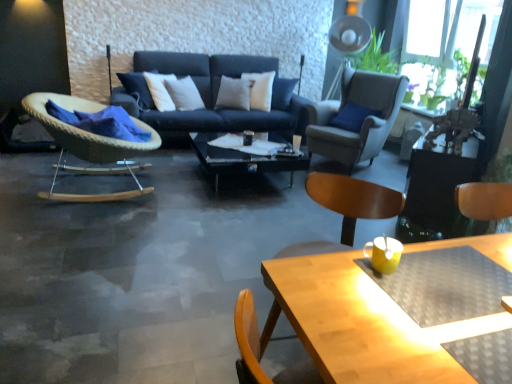
The height and width of the screenshot is (384, 512). Describe the element at coordinates (87, 143) in the screenshot. I see `woven wood rocking chair at left, acting as the 2th chair starting from the right` at that location.

Find the location of a particular element. The image size is (512, 384). green leafy plant at upper right is located at coordinates (433, 84).

Where is `transparent glass coffee table at center`? transparent glass coffee table at center is located at coordinates (241, 160).

This screenshot has width=512, height=384. What are the coordinates of `wooden beach chair at lower right` in the screenshot? It's located at tap(346, 208).

The height and width of the screenshot is (384, 512). I want to click on woven wood rocking chair at left, acting as the 2th chair starting from the right, so click(x=87, y=143).

From the picture: From a real-world perspective, is suede-like beige armchair at upper right, which appears as the second chair when viewed from the left, on woven wood rocking chair at left, arranged as the first chair when viewed from the left?

Yes, from a real-world perspective, suede-like beige armchair at upper right, which appears as the second chair when viewed from the left, is over woven wood rocking chair at left, arranged as the first chair when viewed from the left

Consider the image. Does suede-like beige armchair at upper right, which appears as the second chair when viewed from the left, turn towards woven wood rocking chair at left, acting as the 2th chair starting from the right?

Yes, suede-like beige armchair at upper right, which appears as the second chair when viewed from the left, is turned towards woven wood rocking chair at left, acting as the 2th chair starting from the right.

Considering the sizes of objects suede-like beige armchair at upper right, which appears as the second chair when viewed from the left, and woven wood rocking chair at left, arranged as the first chair when viewed from the left, in the image provided, who is smaller, suede-like beige armchair at upper right, which appears as the second chair when viewed from the left, or woven wood rocking chair at left, arranged as the first chair when viewed from the left,?

Smaller between the two is suede-like beige armchair at upper right, which appears as the second chair when viewed from the left.

Would you say suede-like beige armchair at upper right, arranged as the 1th chair when viewed from the right, is outside woven wood rocking chair at left, acting as the 2th chair starting from the right?

Yes.

Does wooden table at lower right have a smaller size compared to black glossy side table at right?

Yes, wooden table at lower right is smaller than black glossy side table at right.

Can you confirm if wooden table at lower right is thinner than black glossy side table at right?

Incorrect, the width of wooden table at lower right is not less than that of black glossy side table at right.

Is wooden table at lower right at the right side of black glossy side table at right?

No.

In the scene shown: Is wooden table at lower right positioned in front of black glossy side table at right?

Yes, it is.

Considering the sizes of objects black glossy side table at right and transparent glass coffee table at center in the image provided, who is shorter, black glossy side table at right or transparent glass coffee table at center?

transparent glass coffee table at center.

Is black glossy side table at right oriented away from transparent glass coffee table at center?

No, black glossy side table at right is not facing the opposite direction of transparent glass coffee table at center.

From the image's perspective, is black glossy side table at right on top of transparent glass coffee table at center?

No, from the image's perspective, black glossy side table at right is not on top of transparent glass coffee table at center.

Who is smaller, black glossy side table at right or transparent glass coffee table at center?

With smaller size is transparent glass coffee table at center.

From a real-world perspective, is suede-like beige armchair at upper right, arranged as the 1th chair when viewed from the right, below green leafy plant at upper right?

Yes.

Is suede-like beige armchair at upper right, which appears as the second chair when viewed from the left, turned away from green leafy plant at upper right?

Yes, green leafy plant at upper right is at the back of suede-like beige armchair at upper right, which appears as the second chair when viewed from the left.

Does suede-like beige armchair at upper right, which appears as the second chair when viewed from the left, have a greater width compared to green leafy plant at upper right?

Correct, the width of suede-like beige armchair at upper right, which appears as the second chair when viewed from the left, exceeds that of green leafy plant at upper right.

From the green leafy plant at upper right, count the 1st chair to the left and point to it. Please provide its 2D coordinates.

[(357, 118)]

In the image, is wooden beach chair at lower right positioned in front of or behind green leafy plant at upper right?

Result: Visually, wooden beach chair at lower right is located in front of green leafy plant at upper right.

Where is `beach chair lying below the green leafy plant at upper right (from the image's perspective)`? This screenshot has width=512, height=384. beach chair lying below the green leafy plant at upper right (from the image's perspective) is located at coordinates (346, 208).

Is point (392, 194) positioned after point (435, 83)?

No.

Is wooden beach chair at lower right thinner than green leafy plant at upper right?

No.

From the image's perspective, which is below, wooden beach chair at lower right or transparent glass coffee table at center?

wooden beach chair at lower right appears lower in the image.

Can you confirm if wooden beach chair at lower right is thinner than transparent glass coffee table at center?

Indeed, wooden beach chair at lower right has a lesser width compared to transparent glass coffee table at center.

Considering the relative positions of wooden beach chair at lower right and transparent glass coffee table at center in the image provided, is wooden beach chair at lower right behind transparent glass coffee table at center?

No, wooden beach chair at lower right is in front of transparent glass coffee table at center.

Is green leafy plant at upper right positioned beyond the bounds of transparent glass coffee table at center?

Absolutely, green leafy plant at upper right is external to transparent glass coffee table at center.

Does green leafy plant at upper right have a greater height compared to transparent glass coffee table at center?

Indeed, green leafy plant at upper right has a greater height compared to transparent glass coffee table at center.

Is green leafy plant at upper right closer to camera compared to transparent glass coffee table at center?

That is False.

Is green leafy plant at upper right oriented towards transparent glass coffee table at center?

Yes, green leafy plant at upper right is turned towards transparent glass coffee table at center.

This screenshot has width=512, height=384. Find the location of `chair on the left of suede-like beige armchair at upper right, which appears as the second chair when viewed from the left`. chair on the left of suede-like beige armchair at upper right, which appears as the second chair when viewed from the left is located at coordinates (87, 143).

Image resolution: width=512 pixels, height=384 pixels. Identify the location of table that is in front of the black glossy side table at right. (352, 324).

Considering their positions, is wooden beach chair at lower right positioned further to transparent glass coffee table at center than wooden table at lower right?

wooden table at lower right is positioned further to the anchor transparent glass coffee table at center.

Looking at the image, which one is located closer to wooden table at lower right, woven wood rocking chair at left, acting as the 2th chair starting from the right, or transparent glass coffee table at center?

woven wood rocking chair at left, acting as the 2th chair starting from the right, is positioned closer to the anchor wooden table at lower right.

When comparing their distances from woven wood rocking chair at left, acting as the 2th chair starting from the right, does transparent glass coffee table at center or black glossy side table at right seem closer?

transparent glass coffee table at center is positioned closer to the anchor woven wood rocking chair at left, acting as the 2th chair starting from the right.

When comparing their distances from green leafy plant at upper right, does wooden table at lower right or transparent glass coffee table at center seem further?

wooden table at lower right.

When comparing their distances from suede-like beige armchair at upper right, which appears as the second chair when viewed from the left, does wooden beach chair at lower right or woven wood rocking chair at left, arranged as the first chair when viewed from the left, seem closer?

wooden beach chair at lower right.

Based on the photo, based on their spatial positions, is wooden table at lower right or woven wood rocking chair at left, arranged as the first chair when viewed from the left, further from suede-like beige armchair at upper right, which appears as the second chair when viewed from the left?

Based on the image, wooden table at lower right appears to be further to suede-like beige armchair at upper right, which appears as the second chair when viewed from the left.

From the image, which object appears to be nearer to green leafy plant at upper right, wooden beach chair at lower right or transparent glass coffee table at center?

transparent glass coffee table at center.

Based on their spatial positions, is suede-like beige armchair at upper right, which appears as the second chair when viewed from the left, or transparent glass coffee table at center further from wooden table at lower right?

suede-like beige armchair at upper right, which appears as the second chair when viewed from the left.

At what (x,y) coordinates should I click in order to perform the action: click on chair situated between transparent glass coffee table at center and green leafy plant at upper right from left to right. Please return your answer as a coordinate pair (x, y). Looking at the image, I should click on (357, 118).

Locate an element on the screen. coffee table between wooden table at lower right and suede-like beige armchair at upper right, arranged as the 1th chair when viewed from the right, from front to back is located at coordinates (241, 160).

Find the location of a particular element. side table located between wooden table at lower right and green leafy plant at upper right in the depth direction is located at coordinates (434, 189).

Find the location of a particular element. Image resolution: width=512 pixels, height=384 pixels. beach chair located between wooden table at lower right and green leafy plant at upper right in the depth direction is located at coordinates (346, 208).